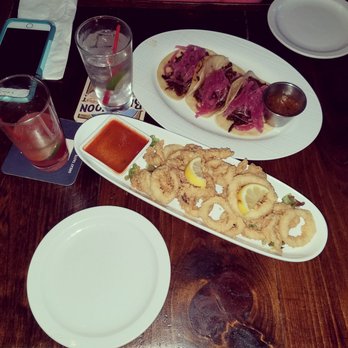
Locate an element on the screen. The image size is (348, 348). coasters is located at coordinates (63, 170), (82, 110).